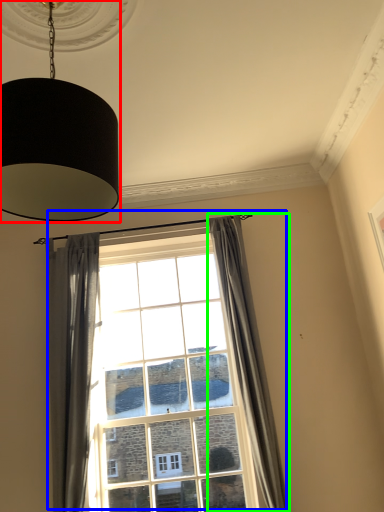
Question: Which is nearer to the lamp (highlighted by a red box)? window (highlighted by a blue box) or curtain (highlighted by a green box).

Choices:
 (A) window
 (B) curtain

Answer: (B)